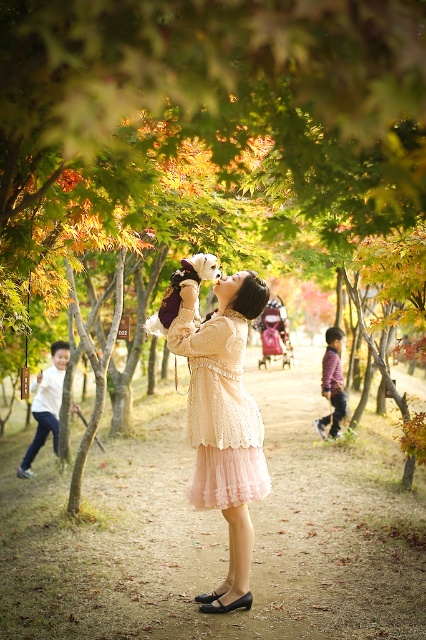
Question: Does lace fabric dress at center appear under light brown fabric jacket at lower right?

Choices:
 (A) yes
 (B) no

Answer: (B)

Question: Which point appears farthest from the camera in this image?

Choices:
 (A) (391, 458)
 (B) (325, 339)

Answer: (B)

Question: Which object is positioned farthest from the white cotton shirt at left?

Choices:
 (A) lace fabric dress at center
 (B) smooth dirt path at center

Answer: (A)

Question: Is white cotton shirt at left to the right of light brown fabric jacket at lower right from the viewer's perspective?

Choices:
 (A) yes
 (B) no

Answer: (B)

Question: Where is white cotton shirt at left located in relation to light brown fabric jacket at lower right in the image?

Choices:
 (A) left
 (B) right

Answer: (A)

Question: Which point is farther to the camera?

Choices:
 (A) light brown fabric jacket at lower right
 (B) white cotton shirt at left
 (C) smooth dirt path at center

Answer: (A)